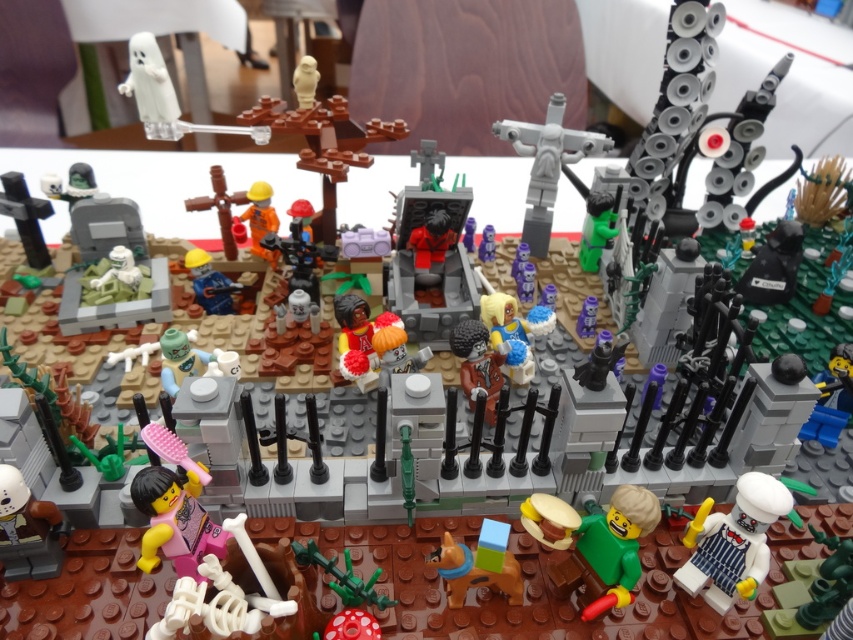
Which is behind, point (427, 276) or point (204, 260)?

The point (204, 260) is behind.

Is shiny red suit at center to the left of blue plastic construction worker at center from the viewer's perspective?

In fact, shiny red suit at center is to the right of blue plastic construction worker at center.

Where is `shiny red suit at center`? The image size is (853, 640). shiny red suit at center is located at coordinates (430, 256).

Is white glossy chef hat at lower right positioned behind shiny red suit at center?

No, white glossy chef hat at lower right is closer to the viewer.

Where is `white glossy chef hat at lower right`? white glossy chef hat at lower right is located at coordinates (733, 541).

Who is more distant from viewer, (686,577) or (412,241)?

The point (412,241) is behind.

Where is `white glossy chef hat at lower right`? The image size is (853, 640). white glossy chef hat at lower right is located at coordinates (733, 541).

Who is more distant from viewer, (144, 81) or (199, 294)?

Positioned behind is point (199, 294).

Is point (132, 84) in front of point (225, 301)?

Yes.

Identify the location of white matte ghost at upper left. This screenshot has width=853, height=640. (151, 88).